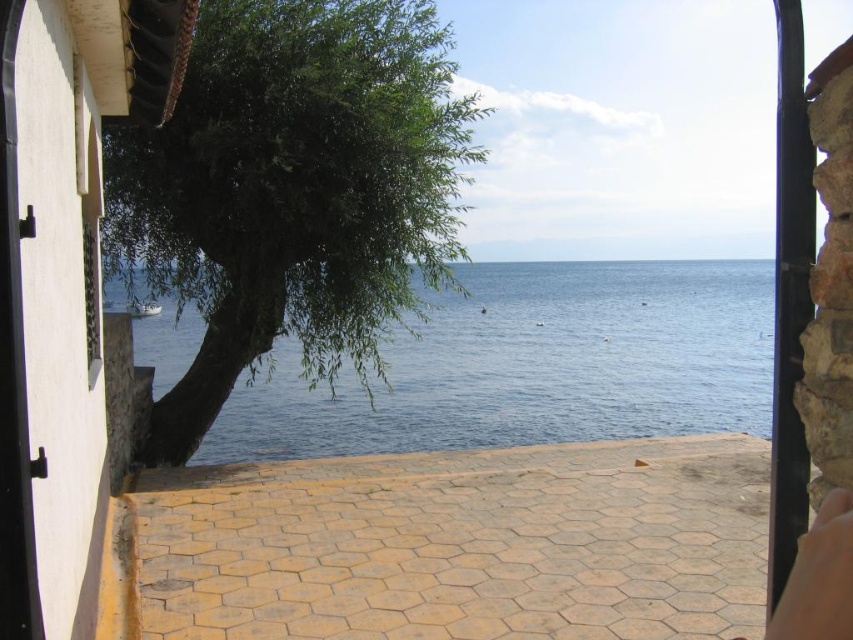
You are standing in the doorway and want to take a photo of the green leafy tree at left and the smooth skin at lower right. Which object should you zoom in more on to capture details, considering their sizes?

Since the green leafy tree at left is larger than the smooth skin at lower right, you should zoom in more on the smooth skin at lower right to capture its details properly.